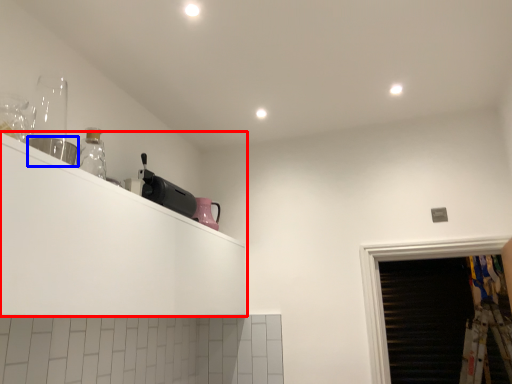
Question: Among these objects, which one is nearest to the camera, shelf (highlighted by a red box) or appliance (highlighted by a blue box)?

Choices:
 (A) shelf
 (B) appliance

Answer: (A)